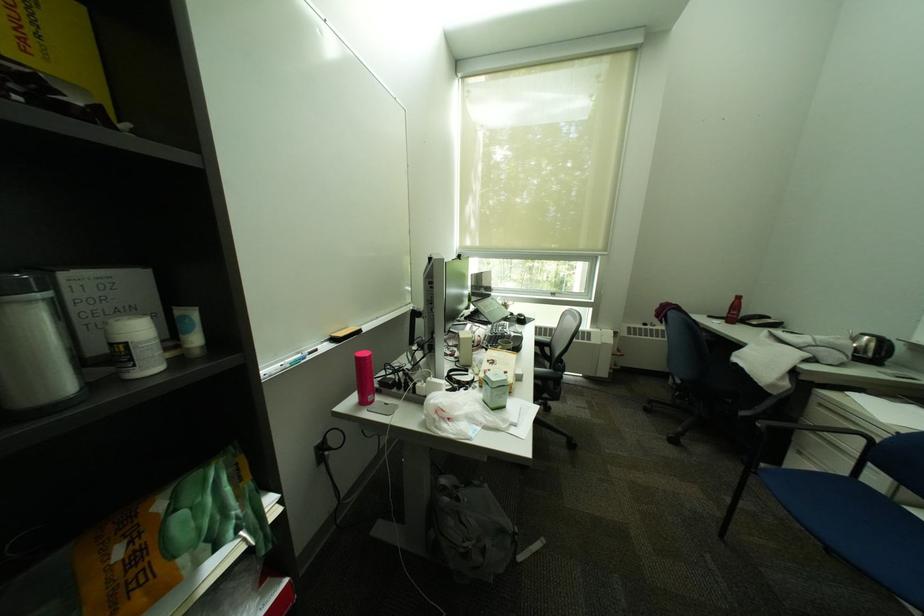
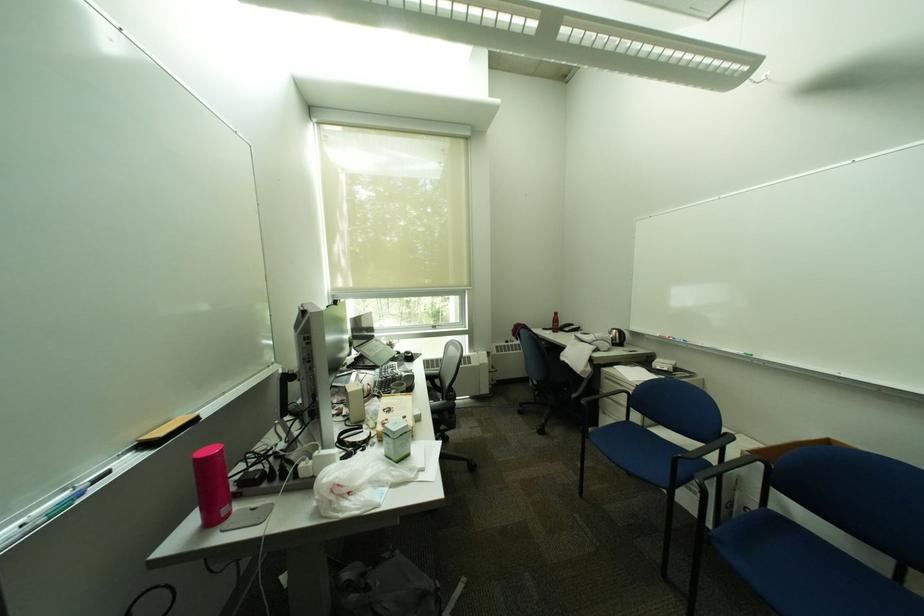
The images are taken continuously from a first-person perspective. In which direction are you moving?

The cameraman moved toward left, backward.